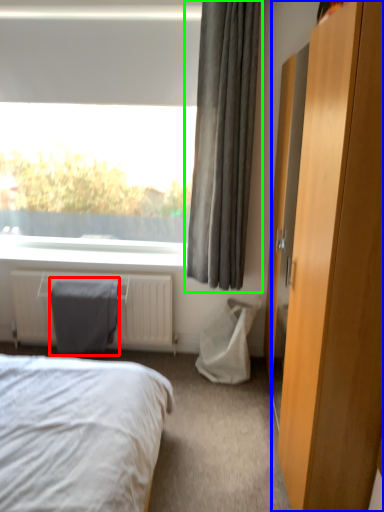
Question: Considering the real-world distances, which object is farthest from gray (highlighted by a red box)? dresser (highlighted by a blue box) or curtain (highlighted by a green box)?

Choices:
 (A) dresser
 (B) curtain

Answer: (A)